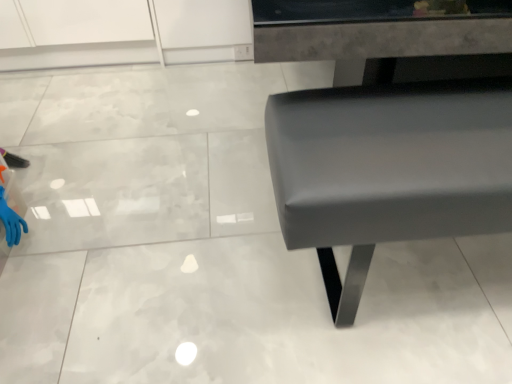
Question: From a real-world perspective, is blue rubber glove at lower left located higher than matte gray bench at center?

Choices:
 (A) yes
 (B) no

Answer: (B)

Question: Is there a large distance between blue rubber glove at lower left and matte gray bench at center?

Choices:
 (A) no
 (B) yes

Answer: (B)

Question: Is blue rubber glove at lower left aimed at matte gray bench at center?

Choices:
 (A) yes
 (B) no

Answer: (A)

Question: Can you confirm if blue rubber glove at lower left is positioned to the right of matte gray bench at center?

Choices:
 (A) yes
 (B) no

Answer: (B)

Question: Is blue rubber glove at lower left with matte gray bench at center?

Choices:
 (A) no
 (B) yes

Answer: (A)

Question: Is blue rubber glove at lower left behind matte gray bench at center?

Choices:
 (A) no
 (B) yes

Answer: (B)

Question: From a real-world perspective, is matte gray bench at center positioned under blue rubber glove at lower left based on gravity?

Choices:
 (A) no
 (B) yes

Answer: (A)

Question: Is blue rubber glove at lower left inside matte gray bench at center?

Choices:
 (A) no
 (B) yes

Answer: (A)

Question: Is matte gray bench at center aimed at blue rubber glove at lower left?

Choices:
 (A) no
 (B) yes

Answer: (A)

Question: Is matte gray bench at center at the left side of blue rubber glove at lower left?

Choices:
 (A) no
 (B) yes

Answer: (A)

Question: From the image's perspective, is matte gray bench at center under blue rubber glove at lower left?

Choices:
 (A) yes
 (B) no

Answer: (B)

Question: Is matte gray bench at center positioned in front of blue rubber glove at lower left?

Choices:
 (A) yes
 (B) no

Answer: (A)

Question: From a real-world perspective, is blue rubber glove at lower left positioned above or below matte gray bench at center?

Choices:
 (A) below
 (B) above

Answer: (A)